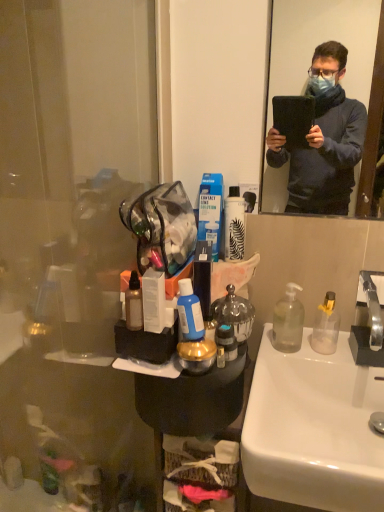
Question: Could translucent plastic bottle at center, which is the first toiletries from right to left, be considered to be inside silver metallic faucet at right?

Choices:
 (A) yes
 (B) no

Answer: (B)

Question: Is silver metallic faucet at right positioned beyond the bounds of translucent plastic bottle at center, the 3th toiletries from the left?

Choices:
 (A) yes
 (B) no

Answer: (A)

Question: Does silver metallic faucet at right lie behind translucent plastic bottle at center, the 3th toiletries from the left?

Choices:
 (A) no
 (B) yes

Answer: (A)

Question: Is silver metallic faucet at right aimed at translucent plastic bottle at center, which is the first toiletries from right to left?

Choices:
 (A) yes
 (B) no

Answer: (B)

Question: Is silver metallic faucet at right far away from translucent plastic bottle at center, the 3th toiletries from the left?

Choices:
 (A) yes
 (B) no

Answer: (B)

Question: From a real-world perspective, is blue matte bottle at center, which is counted as the second toiletries, starting from the right, physically located above or below translucent plastic bottle at center, the 3th toiletries from the left?

Choices:
 (A) below
 (B) above

Answer: (B)

Question: In the image, is blue matte bottle at center, which is counted as the second toiletries, starting from the right, on the left side or the right side of translucent plastic bottle at center, the 3th toiletries from the left?

Choices:
 (A) right
 (B) left

Answer: (B)

Question: In the image, is blue matte bottle at center, which is the 2th toiletries in left-to-right order, positioned in front of or behind translucent plastic bottle at center, the 3th toiletries from the left?

Choices:
 (A) front
 (B) behind

Answer: (A)

Question: Is blue matte bottle at center, which is the 2th toiletries in left-to-right order, wider or thinner than translucent plastic bottle at center, the 3th toiletries from the left?

Choices:
 (A) wide
 (B) thin

Answer: (A)

Question: In terms of width, does silver metallic faucet at right look wider or thinner when compared to metallic fabric handbag at upper left?

Choices:
 (A) wide
 (B) thin

Answer: (B)

Question: Is point (367, 273) closer or farther from the camera than point (193, 229)?

Choices:
 (A) closer
 (B) farther

Answer: (B)

Question: Based on their positions, is silver metallic faucet at right located to the left or right of metallic fabric handbag at upper left?

Choices:
 (A) right
 (B) left

Answer: (A)

Question: Is silver metallic faucet at right situated inside metallic fabric handbag at upper left or outside?

Choices:
 (A) outside
 (B) inside

Answer: (A)

Question: Considering their positions, is translucent plastic bottle at center, which is the first toiletries from right to left, located in front of or behind white glossy sink at lower right?

Choices:
 (A) behind
 (B) front

Answer: (A)

Question: In the image, is translucent plastic bottle at center, which is the first toiletries from right to left, on the left side or the right side of white glossy sink at lower right?

Choices:
 (A) left
 (B) right

Answer: (A)